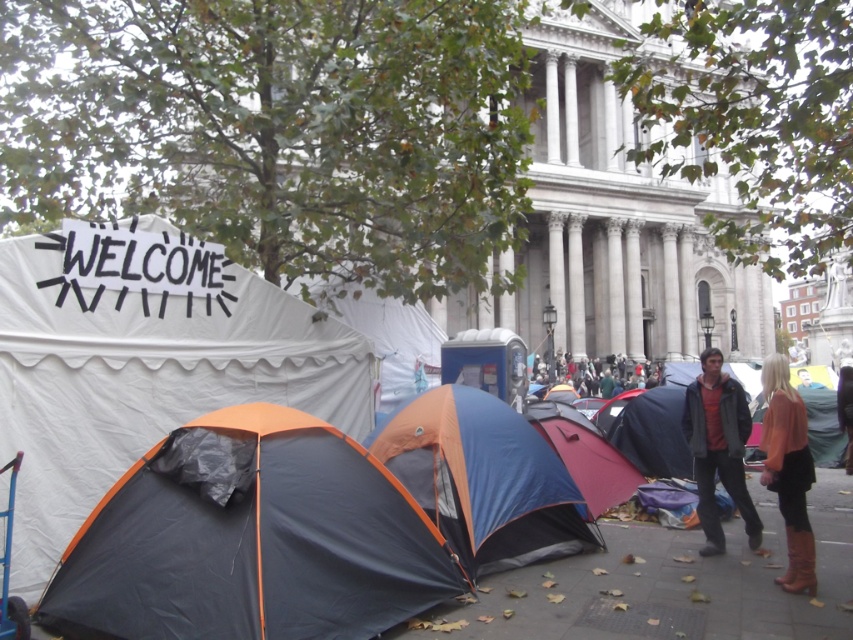
Question: Estimate the real-world distances between objects in this image. Which object is farther from the green fabric tent at center?

Choices:
 (A) smooth concrete pavement at lower center
 (B) orange and blue tent at center
 (C) dark gray jacket at lower right
 (D) white canvas tent at left

Answer: (D)

Question: Is black tarpaulin tent at lower left bigger than brown leather boots at lower right?

Choices:
 (A) yes
 (B) no

Answer: (B)

Question: Is smooth concrete pavement at lower center below dark gray jacket at lower right?

Choices:
 (A) yes
 (B) no

Answer: (A)

Question: Considering the real-world distances, which object is closest to the leather boots at lower right?

Choices:
 (A) brown leather boots at lower right
 (B) green fabric tent at center
 (C) orange and blue tent at center

Answer: (A)

Question: Which point is farther to the camera?

Choices:
 (A) green fabric tent at center
 (B) leather boots at lower right

Answer: (A)

Question: Is white canvas tent at left wider than black tarpaulin tent at lower left?

Choices:
 (A) yes
 (B) no

Answer: (B)